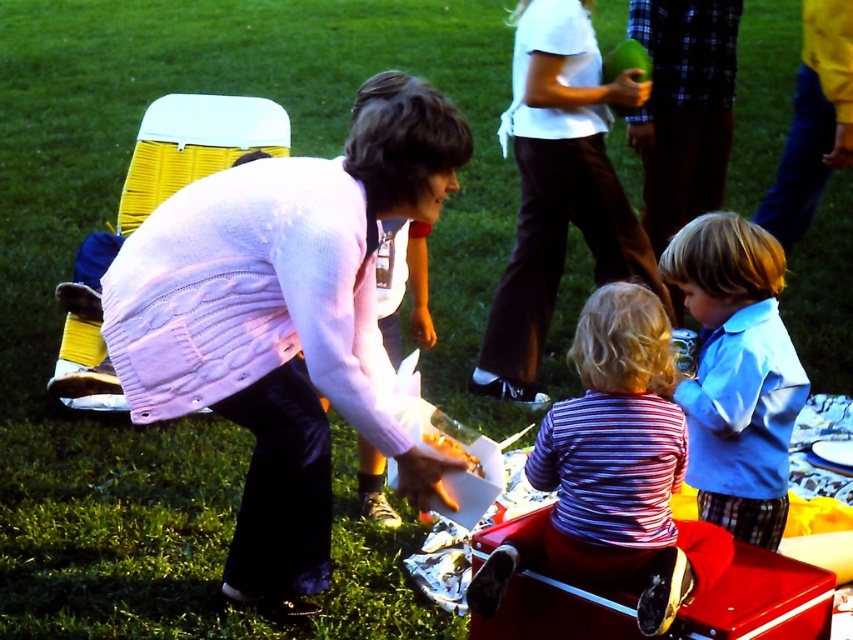
Measure the distance between pink knit sweater at center and camera.

pink knit sweater at center and camera are 2.61 meters apart from each other.

Consider the image. Between pink knit sweater at center and yellow matte food at lower center, which one is positioned higher?

pink knit sweater at center is above.

Identify the location of pink knit sweater at center. This screenshot has width=853, height=640. (285, 321).

Who is positioned more to the left, plaid fabric pants at right or yellow matte food at lower center?

From the viewer's perspective, yellow matte food at lower center appears more on the left side.

How much distance is there between plaid fabric pants at right and yellow matte food at lower center?

plaid fabric pants at right is 7.72 feet away from yellow matte food at lower center.

What do you see at coordinates (683, 108) in the screenshot? This screenshot has height=640, width=853. I see `plaid fabric pants at right` at bounding box center [683, 108].

At what (x,y) coordinates should I click in order to perform the action: click on plaid fabric pants at right. Please return your answer as a coordinate pair (x, y). Image resolution: width=853 pixels, height=640 pixels. Looking at the image, I should click on (683, 108).

How much distance is there between striped cotton shirt at center and yellow matte food at lower center?

striped cotton shirt at center is 49.34 centimeters from yellow matte food at lower center.

Is point (590, 534) positioned behind point (445, 445)?

No, (590, 534) is in front of (445, 445).

You are a GUI agent. You are given a task and a screenshot of the screen. Output one action in this format:
    pyautogui.click(x=<x>, y=<y>)
    Task: Click on the striped cotton shirt at center
    
    Given the screenshot: What is the action you would take?
    pyautogui.click(x=613, y=472)